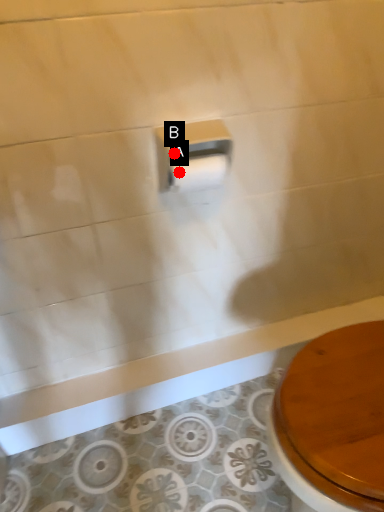
Question: Two points are circled on the image, labeled by A and B beside each circle. Which point is farther from the camera taking this photo?

Choices:
 (A) A is further
 (B) B is further

Answer: (A)